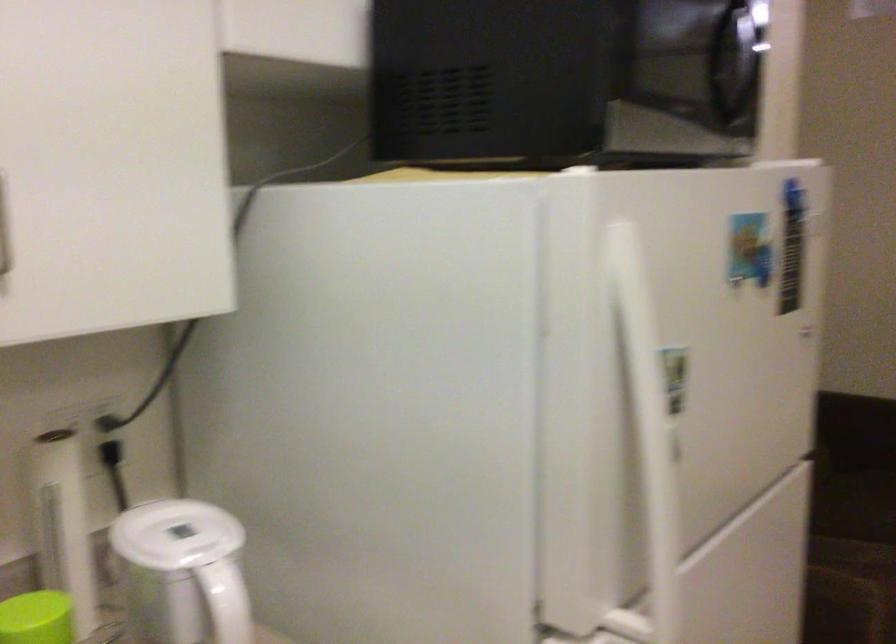
This screenshot has height=644, width=896. Find the location of `white refrigerator handle`. white refrigerator handle is located at coordinates (645, 428).